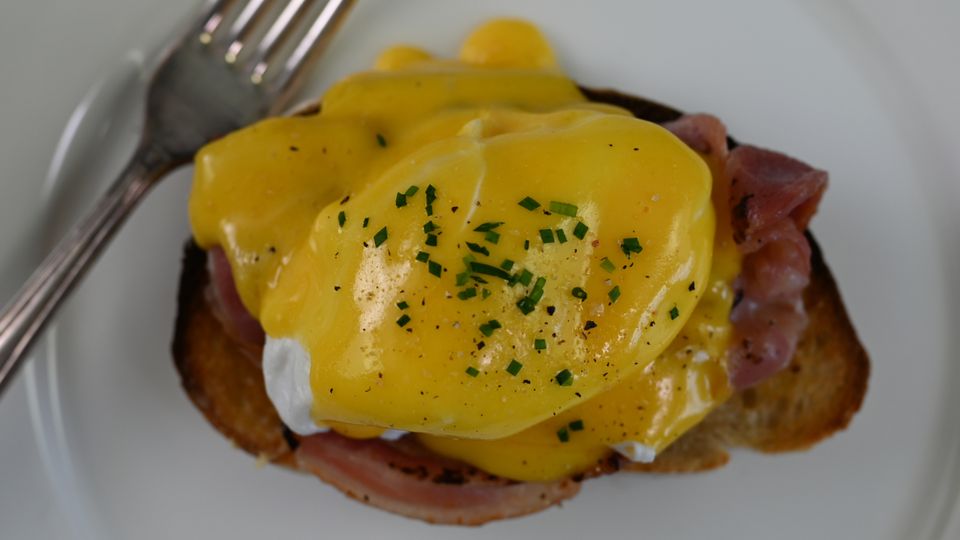
This screenshot has height=540, width=960. I want to click on plate, so click(752, 64).